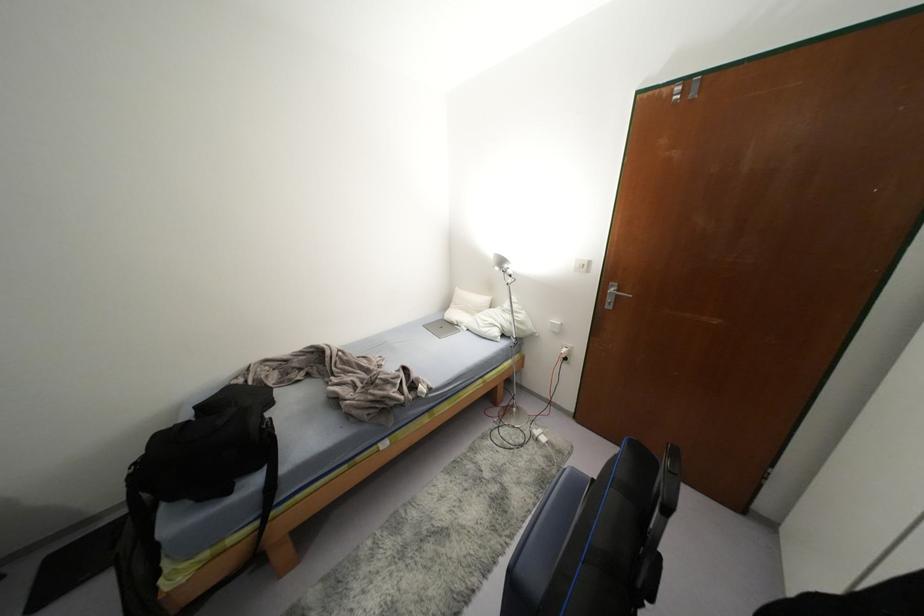
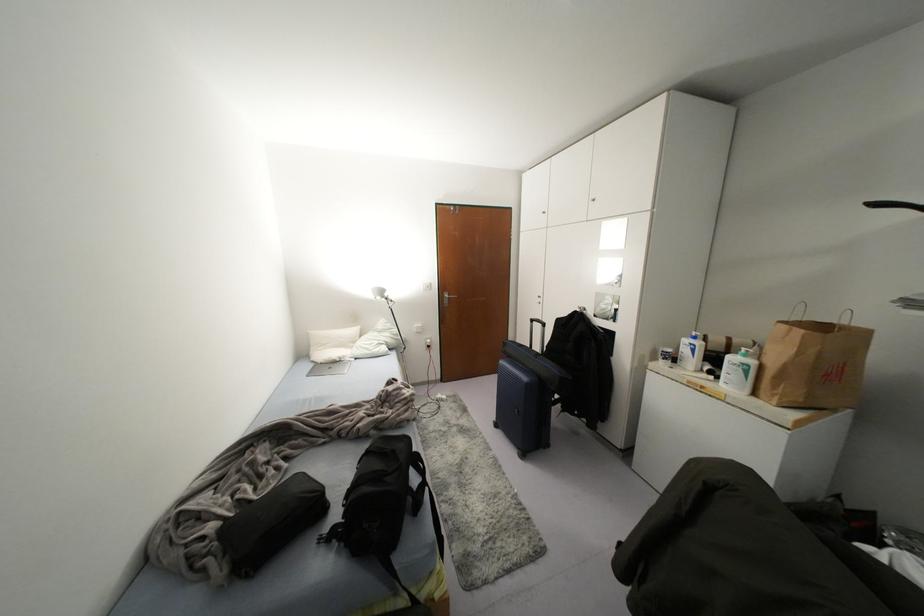
Question: I am providing you with two images of the same scene from different viewpoints. Please identify which objects are invisible in image2.

Choices:
 (A) black backpack
 (B) silver laptop
 (C) silver door handle
 (D) none of these

Answer: (D)